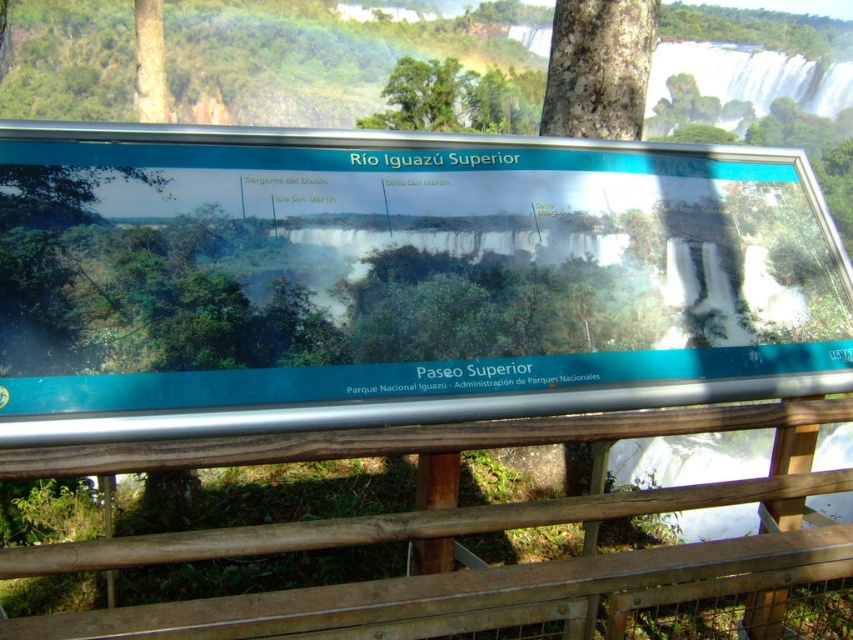
Is wooden at lower center positioned in front of brown rough bark tree at upper center?

That is True.

This screenshot has width=853, height=640. Describe the element at coordinates (485, 532) in the screenshot. I see `wooden at lower center` at that location.

Who is more forward, (415,611) or (622,134)?

Positioned in front is point (415,611).

At what (x,y) coordinates should I click in order to perform the action: click on wooden at lower center. Please return your answer as a coordinate pair (x, y). The width and height of the screenshot is (853, 640). Looking at the image, I should click on (485, 532).